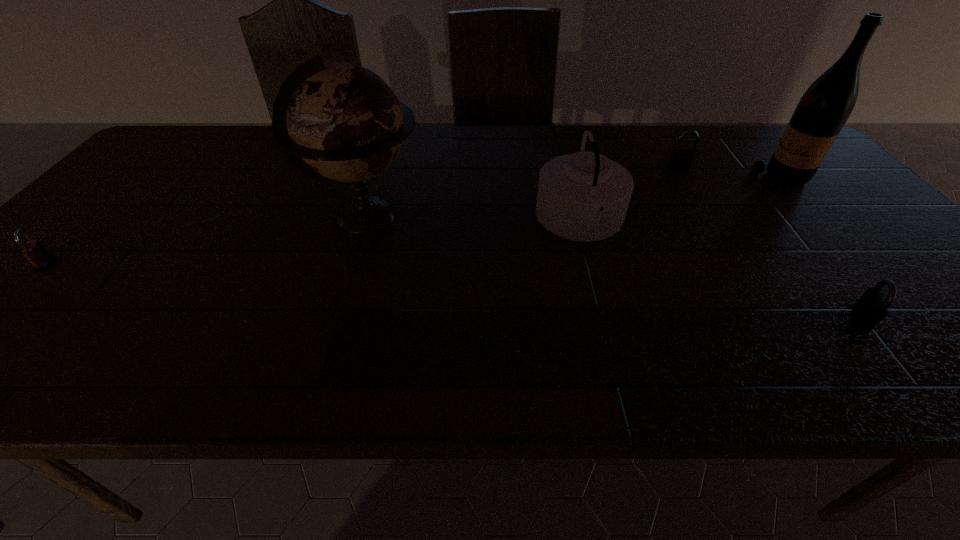
Locate which object ranks fourth in proximity to the fourth object from right to left. Please provide its 2D coordinates. Your answer should be formatted as a tuple, i.e. [(x, y)], where the tuple contains the x and y coordinates of a point satisfying the conditions above.

[(823, 110)]

Find the location of `object that is the second closest to the leftmost padlock`. object that is the second closest to the leftmost padlock is located at coordinates (584, 196).

Select which padlock appears as the third closest to the wine bottle. Please provide its 2D coordinates. Your answer should be formatted as a tuple, i.e. [(x, y)], where the tuple contains the x and y coordinates of a point satisfying the conditions above.

[(33, 250)]

Point out which padlock is positioned as the third nearest to the wine bottle. Please provide its 2D coordinates. Your answer should be formatted as a tuple, i.e. [(x, y)], where the tuple contains the x and y coordinates of a point satisfying the conditions above.

[(33, 250)]

Locate an element on the screen. free space that satisfies the following two spatial constraints: 1. on the front-facing side of the farthest padlock; 2. on the spout of the fourth object from right to left is located at coordinates (710, 221).

The image size is (960, 540). I want to click on free point that satisfies the following two spatial constraints: 1. on the front-facing side of the fourth object from left to right; 2. on the front of the fifth object from right to left showing Asia, so click(x=708, y=218).

The width and height of the screenshot is (960, 540). What are the coordinates of `free space that satisfies the following two spatial constraints: 1. on the front-facing side of the farthest padlock; 2. on the spout of the fourth object from right to left` in the screenshot? It's located at (710, 221).

Where is `free space in the image that satisfies the following two spatial constraints: 1. on the front-facing side of the second padlock from right to left; 2. on the front of the second object from left to right showing Asia`? The height and width of the screenshot is (540, 960). free space in the image that satisfies the following two spatial constraints: 1. on the front-facing side of the second padlock from right to left; 2. on the front of the second object from left to right showing Asia is located at coordinates (708, 218).

Where is `free space that satisfies the following two spatial constraints: 1. on the front of the nearest padlock showing Asia; 2. on the right side of the fifth object from right to left`? The height and width of the screenshot is (540, 960). free space that satisfies the following two spatial constraints: 1. on the front of the nearest padlock showing Asia; 2. on the right side of the fifth object from right to left is located at coordinates (337, 319).

Find the location of a particular element. This screenshot has width=960, height=540. vacant area in the image that satisfies the following two spatial constraints: 1. on the front-facing side of the farthest padlock; 2. on the spout of the kettle is located at coordinates (710, 221).